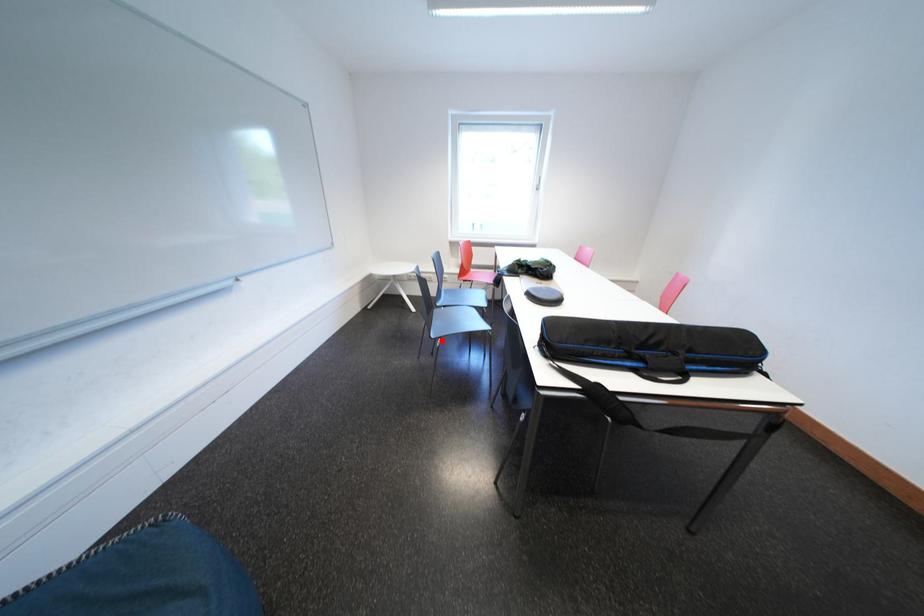
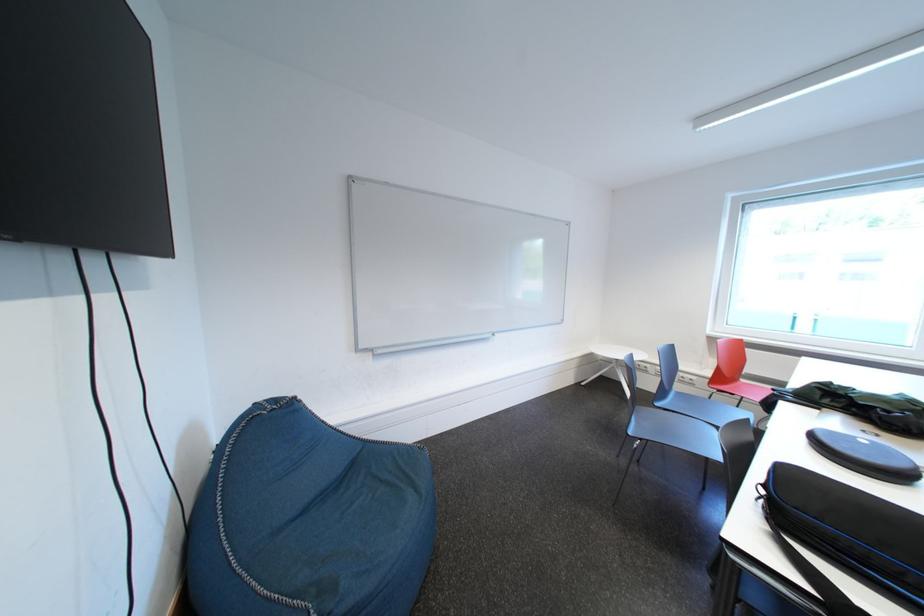
Where in the second image is the point corresponding to the highlighted location from the first image?

(639, 437)